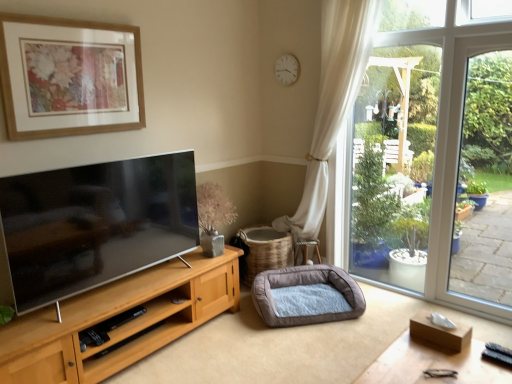
Locate an element on the screen. empty space that is ontop of wooden table at lower right is located at coordinates (433, 365).